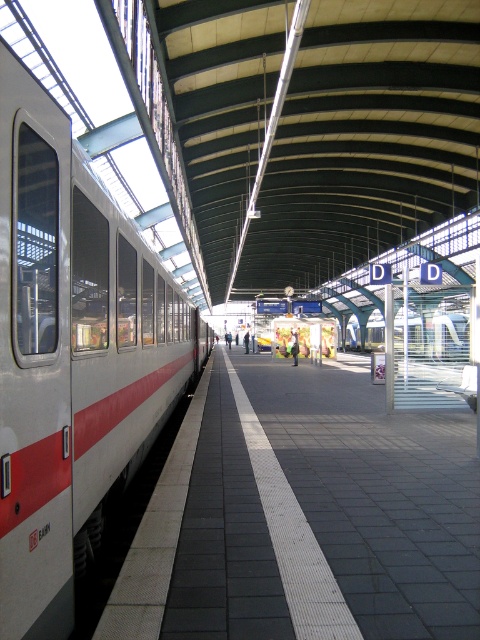
Question: Which object appears closest to the camera in this image?

Choices:
 (A) white glossy train at left
 (B) white glossy platform at center
 (C) white glossy train at center

Answer: (A)

Question: Is white glossy train at left smaller than white glossy train at center?

Choices:
 (A) yes
 (B) no

Answer: (A)

Question: Can you confirm if white glossy train at left is positioned below white glossy train at center?

Choices:
 (A) no
 (B) yes

Answer: (A)

Question: Which point is farther to the camera?

Choices:
 (A) (103, 428)
 (B) (411, 344)

Answer: (B)

Question: Which object is positioned farthest from the white glossy platform at center?

Choices:
 (A) white glossy train at center
 (B) white glossy train at left

Answer: (A)

Question: Is white glossy train at left to the left of white glossy train at center from the viewer's perspective?

Choices:
 (A) no
 (B) yes

Answer: (B)